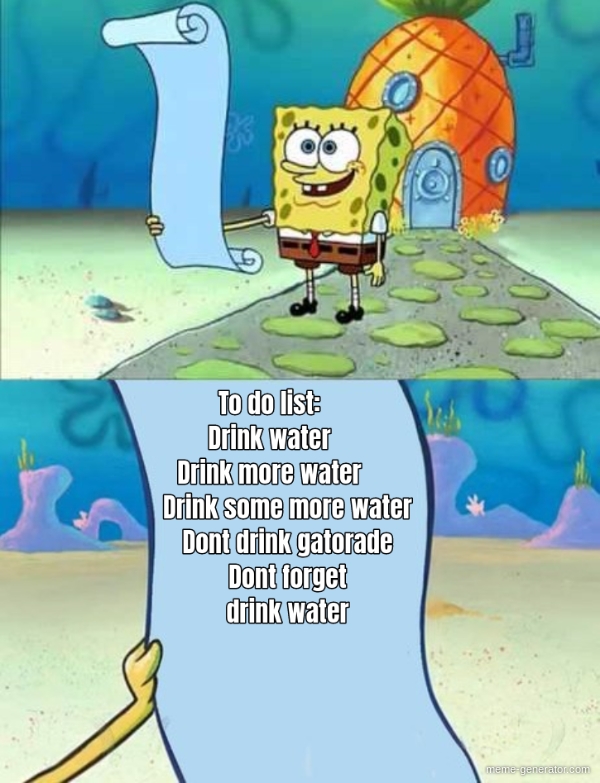
The image size is (600, 783). I want to click on door, so click(428, 175).